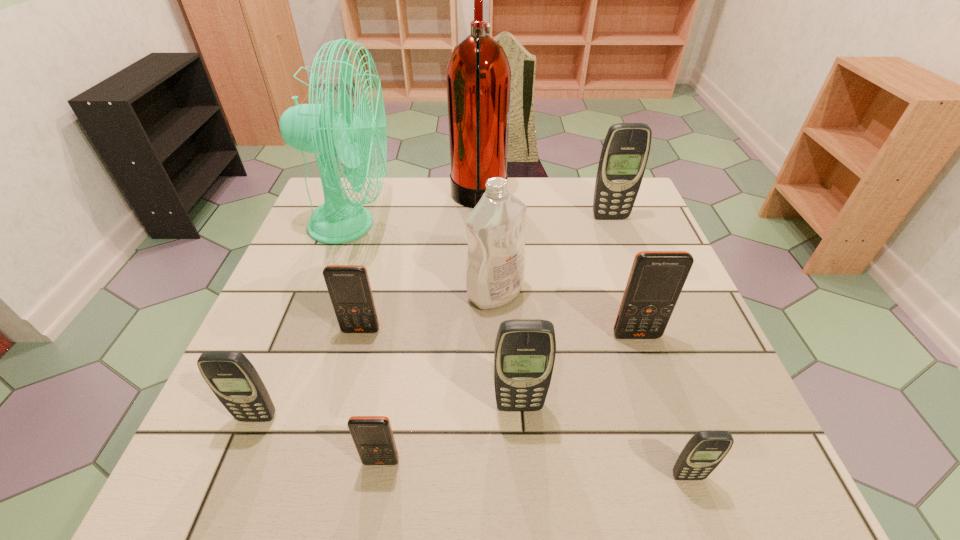
Locate an element on the screen. Image resolution: width=960 pixels, height=540 pixels. the fifth farthest cellular telephone is located at coordinates (233, 379).

Image resolution: width=960 pixels, height=540 pixels. What are the coordinates of `the leftmost orange cellular telephone` in the screenshot? It's located at (349, 288).

Where is `the second smallest orange cellular telephone`? This screenshot has width=960, height=540. the second smallest orange cellular telephone is located at coordinates (349, 288).

You are a GUI agent. You are given a task and a screenshot of the screen. Output one action in this format:
    pyautogui.click(x=<x>, y=<y>)
    Task: Click on the sixth farthest cellular telephone
    
    Given the screenshot: What is the action you would take?
    pyautogui.click(x=372, y=435)

Locate an element on the screen. This screenshot has height=540, width=960. the second orange cellular telephone from right to left is located at coordinates (372, 435).

Where is `the nearest object`? the nearest object is located at coordinates (705, 450).

The width and height of the screenshot is (960, 540). Find the location of `the smallest gray cellular telephone`. the smallest gray cellular telephone is located at coordinates (705, 450).

Locate an element on the screen. The width and height of the screenshot is (960, 540). vacant area located on the front-facing side of the red fire extinguisher is located at coordinates (528, 199).

I want to click on vacant space located 0.080m in front of the fan to blow air, so click(x=421, y=225).

Identify the location of vacant area situated 0.320m on the back of the detergent. This screenshot has width=960, height=540. (492, 201).